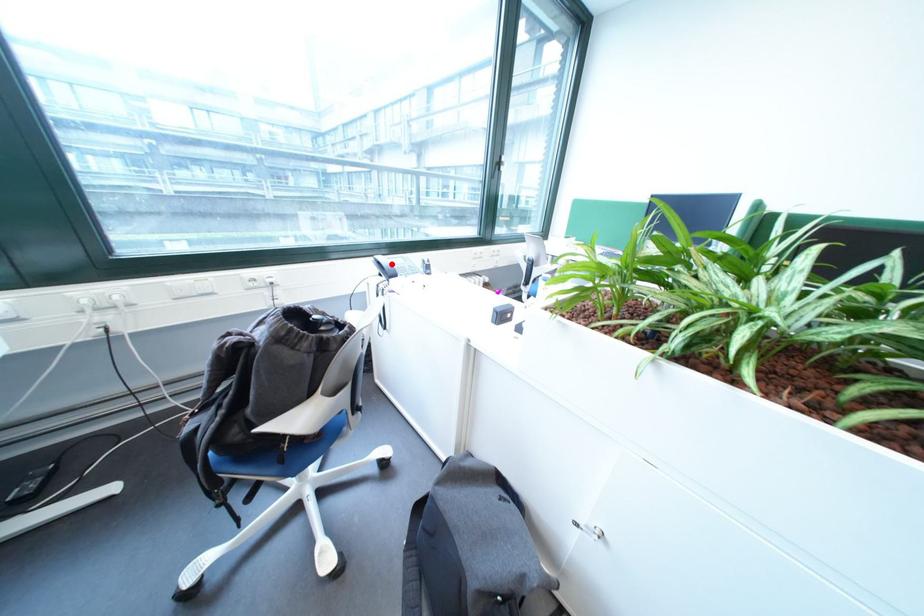
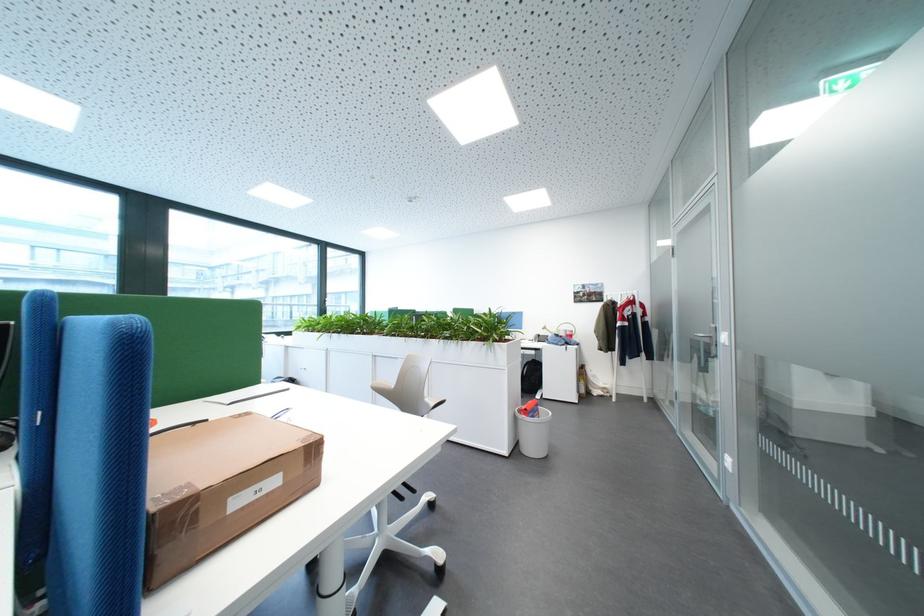
Question: I am providing you with two images of the same scene from different viewpoints. A red point is marked on the first image. Can you still see the location of the red point in image 2?

Choices:
 (A) Yes
 (B) No

Answer: (B)